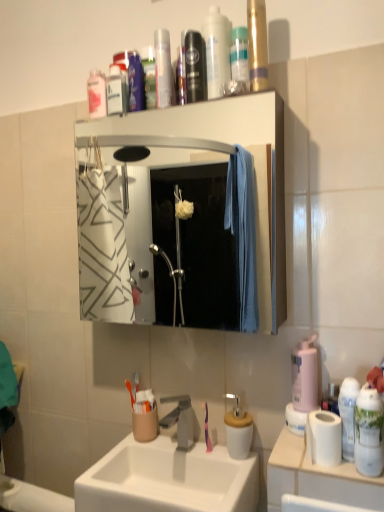
Find the location of `pink matte bottle at right, which appears as the second cleaning product when viewed from the top`. pink matte bottle at right, which appears as the second cleaning product when viewed from the top is located at coordinates (304, 376).

Measure the distance between white plastic cup at right and camera.

white plastic cup at right and camera are 34.47 inches apart.

Describe the element at coordinates (163, 68) in the screenshot. I see `metallic silver can at upper center, the 1th toiletry viewed from the back` at that location.

The image size is (384, 512). Describe the element at coordinates (369, 432) in the screenshot. I see `white glossy bottle at right, arranged as the first cleaning product when ordered from the bottom` at that location.

The image size is (384, 512). What do you see at coordinates (96, 94) in the screenshot? I see `translucent plastic mouthwash at upper left, which is counted as the 3th mouthwash, starting from the right` at bounding box center [96, 94].

Find the location of a particular element. This screenshot has width=384, height=512. pink matte bottle at right, which is the 2th cleaning product from back to front is located at coordinates (304, 376).

Does point (209, 446) appear closer or farther from the camera than point (198, 36)?

Point (209, 446).

Which of these two, purple glossy toothbrush at sink or shiny metallic can at upper center, the 3th mouthwash viewed from the back, stands taller?

Standing taller between the two is shiny metallic can at upper center, the 3th mouthwash viewed from the back.

Is purple glossy toothbrush at sink positioned in front of shiny metallic can at upper center, the 1th mouthwash viewed from the front?

No, purple glossy toothbrush at sink is behind shiny metallic can at upper center, the 1th mouthwash viewed from the front.

Is purple glossy toothbrush at sink located outside shiny metallic can at upper center, the 1th mouthwash viewed from the front?

That's correct, purple glossy toothbrush at sink is outside of shiny metallic can at upper center, the 1th mouthwash viewed from the front.

Considering the sizes of objects metallic silver can at upper center, the first toiletry viewed from the top, and transparent plastic bottle at upper center, the 1th mouthwash from the right, in the image provided, who is shorter, metallic silver can at upper center, the first toiletry viewed from the top, or transparent plastic bottle at upper center, the 1th mouthwash from the right,?

Standing shorter between the two is transparent plastic bottle at upper center, the 1th mouthwash from the right.

Is metallic silver can at upper center, the 2th toiletry from the right, thinner than transparent plastic bottle at upper center, the third mouthwash viewed from the left?

Yes, metallic silver can at upper center, the 2th toiletry from the right, is thinner than transparent plastic bottle at upper center, the third mouthwash viewed from the left.

Is metallic silver can at upper center, the 1th toiletry viewed from the back, beside transparent plastic bottle at upper center, the second mouthwash positioned from the back?

They are not placed beside each other.

From a real-world perspective, is metallic silver can at upper center, the first toiletry in the left-to-right sequence, above or below transparent plastic bottle at upper center, the 1th mouthwash from the right?

From a real-world perspective, metallic silver can at upper center, the first toiletry in the left-to-right sequence, is physically above transparent plastic bottle at upper center, the 1th mouthwash from the right.

Does transparent plastic bottle at upper center, the 1th mouthwash from the right, have a larger size compared to pink matte bottle at right, which is the 2th cleaning product from back to front?

No.

From a real-world perspective, is transparent plastic bottle at upper center, the 1th mouthwash from the right, positioned under pink matte bottle at right, the second cleaning product when ordered from front to back, based on gravity?

No, from a real-world perspective, transparent plastic bottle at upper center, the 1th mouthwash from the right, is not beneath pink matte bottle at right, the second cleaning product when ordered from front to back.

Is pink matte bottle at right, the second cleaning product positioned from the bottom, a part of transparent plastic bottle at upper center, the second mouthwash in the front-to-back sequence?

No, pink matte bottle at right, the second cleaning product positioned from the bottom, is not inside transparent plastic bottle at upper center, the second mouthwash in the front-to-back sequence.

Which object is more forward, transparent plastic bottle at upper center, the second mouthwash in the front-to-back sequence, or pink matte bottle at right, which is the 2th cleaning product from back to front?

pink matte bottle at right, which is the 2th cleaning product from back to front, is more forward.

I want to click on tap beneath the translucent plastic mouthwash at upper left, the third mouthwash from the front (from a real-world perspective), so click(x=180, y=419).

Is translucent plastic mouthwash at upper left, which is counted as the 3th mouthwash, starting from the right, not inside satin nickel faucet at sink center?

That's correct, translucent plastic mouthwash at upper left, which is counted as the 3th mouthwash, starting from the right, is outside of satin nickel faucet at sink center.

Is translucent plastic mouthwash at upper left, the 1th mouthwash from the back, further to the viewer compared to satin nickel faucet at sink center?

Yes, it is behind satin nickel faucet at sink center.

Looking at this image, is metallic silver can at upper center, the 1th toiletry viewed from the back, oriented towards translucent plastic bottle at upper center, which ranks as the first cleaning product in top-to-bottom order?

No, metallic silver can at upper center, the 1th toiletry viewed from the back, is not aimed at translucent plastic bottle at upper center, which ranks as the first cleaning product in top-to-bottom order.

From the image's perspective, which one is positioned higher, metallic silver can at upper center, the first toiletry in the left-to-right sequence, or translucent plastic bottle at upper center, the 3th cleaning product from the right?

From the image's view, translucent plastic bottle at upper center, the 3th cleaning product from the right, is above.

From the picture: How much distance is there between metallic silver can at upper center, the first toiletry viewed from the top, and translucent plastic bottle at upper center, which ranks as the first cleaning product in top-to-bottom order?

metallic silver can at upper center, the first toiletry viewed from the top, and translucent plastic bottle at upper center, which ranks as the first cleaning product in top-to-bottom order, are 5.19 inches apart from each other.

Can you confirm if metallic silver can at upper center, the second toiletry positioned from the front, is thinner than translucent plastic bottle at upper center, positioned as the 1th cleaning product in left-to-right order?

Yes.

Is white glossy bottle at right, arranged as the third cleaning product when viewed from the back, facing away from satin nickel faucet at sink center?

white glossy bottle at right, arranged as the third cleaning product when viewed from the back, does not have its back to satin nickel faucet at sink center.

Is white glossy bottle at right, which ranks as the 3th cleaning product in top-to-bottom order, in contact with satin nickel faucet at sink center?

No, white glossy bottle at right, which ranks as the 3th cleaning product in top-to-bottom order, is not in contact with satin nickel faucet at sink center.

Considering the relative sizes of white glossy bottle at right, which is the third cleaning product from left to right, and satin nickel faucet at sink center in the image provided, is white glossy bottle at right, which is the third cleaning product from left to right, thinner than satin nickel faucet at sink center?

Correct, the width of white glossy bottle at right, which is the third cleaning product from left to right, is less than that of satin nickel faucet at sink center.

From a real-world perspective, relative to satin nickel faucet at sink center, is white glossy bottle at right, which ranks as the 3th cleaning product in top-to-bottom order, vertically above or below?

From a real-world perspective, white glossy bottle at right, which ranks as the 3th cleaning product in top-to-bottom order, is physically above satin nickel faucet at sink center.

From a real-world perspective, which object rests below the other?

In real-world perspective, white glossy spray can at right, marked as the first toiletry in a front-to-back arrangement, is lower.

Considering the relative positions of white glossy spray can at right, the 1th toiletry positioned from the bottom, and translucent plastic mouthwash at upper left, the 1th mouthwash from the back, in the image provided, is white glossy spray can at right, the 1th toiletry positioned from the bottom, behind translucent plastic mouthwash at upper left, the 1th mouthwash from the back,?

No.

Considering the sizes of objects white glossy spray can at right, the 1th toiletry positioned from the bottom, and translucent plastic mouthwash at upper left, the 1th mouthwash from the left, in the image provided, who is bigger, white glossy spray can at right, the 1th toiletry positioned from the bottom, or translucent plastic mouthwash at upper left, the 1th mouthwash from the left,?

With larger size is translucent plastic mouthwash at upper left, the 1th mouthwash from the left.

Measure the distance between white glossy spray can at right, the 1th toiletry positioned from the bottom, and translucent plastic mouthwash at upper left, the third mouthwash from the front.

A distance of 3.53 feet exists between white glossy spray can at right, the 1th toiletry positioned from the bottom, and translucent plastic mouthwash at upper left, the third mouthwash from the front.

There is a purple glossy toothbrush at sink. In order to click on the 2nd mouthwash above it (from the image's perspective) in this screenshot , I will do `click(195, 67)`.

Identify the location of mouthwash that is the 2nd object to the right of the metallic silver can at upper center, the 2th toiletry in the bottom-to-top sequence, starting at the anchor. This screenshot has width=384, height=512. (239, 55).

From the image, which object appears to be nearer to shiny metallic can at upper center, which is the 2th mouthwash in left-to-right order, white glossy spray can at right, the 1th toiletry positioned from the bottom, or white matte toilet paper at right?

Among the two, white glossy spray can at right, the 1th toiletry positioned from the bottom, is located nearer to shiny metallic can at upper center, which is the 2th mouthwash in left-to-right order.

Looking at the image, which one is located closer to translucent plastic mouthwash at upper left, the 1th mouthwash from the back, transparent plastic bottle at upper center, the 1th mouthwash from the right, or pink matte bottle at right, which appears as the second cleaning product when viewed from the top?

transparent plastic bottle at upper center, the 1th mouthwash from the right, is closer to translucent plastic mouthwash at upper left, the 1th mouthwash from the back.

Estimate the real-world distances between objects in this image. Which object is closer to white plastic cup at right, metallic silver can at upper center, the second toiletry positioned from the front, or satin nickel faucet at sink center?

Based on the image, satin nickel faucet at sink center appears to be nearer to white plastic cup at right.

Considering their positions, is white glossy cabinet at upper center positioned closer to white matte toilet paper at right than satin nickel faucet at sink center?

Among the two, satin nickel faucet at sink center is located nearer to white matte toilet paper at right.

Looking at the image, which one is located further to satin nickel faucet at sink center, metallic silver can at upper center, the 2th toiletry in the bottom-to-top sequence, or white glossy bottle at right, arranged as the third cleaning product when viewed from the back?

metallic silver can at upper center, the 2th toiletry in the bottom-to-top sequence.

In the scene shown: Based on their spatial positions, is white glossy bottle at right, which ranks as the 3th cleaning product in top-to-bottom order, or translucent plastic bottle at upper center, positioned as the 1th cleaning product in left-to-right order, further from satin nickel faucet at sink center?

translucent plastic bottle at upper center, positioned as the 1th cleaning product in left-to-right order, is positioned further to the anchor satin nickel faucet at sink center.

Considering their positions, is translucent plastic bottle at upper center, the 3th cleaning product from the right, positioned further to purple glossy toothbrush at sink than satin nickel faucet at sink center?

translucent plastic bottle at upper center, the 3th cleaning product from the right, is positioned further to the anchor purple glossy toothbrush at sink.

Which object lies nearer to the anchor point pink matte bottle at right, which appears as the second cleaning product when viewed from the top, white plastic cup at right or satin nickel faucet at sink center?

white plastic cup at right.

Locate an element on the screen. The width and height of the screenshot is (384, 512). toiletry between white glossy cabinet at upper center and white ceramic sink at center from top to bottom is located at coordinates (348, 415).

Locate an element on the screen. The width and height of the screenshot is (384, 512). bathroom cabinet between translucent plastic mouthwash at upper left, the third mouthwash from the front, and satin nickel faucet at sink center vertically is located at coordinates (203, 145).

You are a GUI agent. You are given a task and a screenshot of the screen. Output one action in this format:
    pyautogui.click(x=<x>, y=<y>)
    Task: Click on the toiletry between satin nickel faucet at sink center and white plastic cup at right in the horizontal direction
    
    Given the screenshot: What is the action you would take?
    pyautogui.click(x=348, y=415)

At what (x,y) coordinates should I click in order to perform the action: click on toothbrush between white ceramic sink at center and pink matte bottle at right, the second cleaning product positioned from the bottom, from left to right. Please return your answer as a coordinate pair (x, y). This screenshot has height=512, width=384. Looking at the image, I should click on pyautogui.click(x=207, y=431).